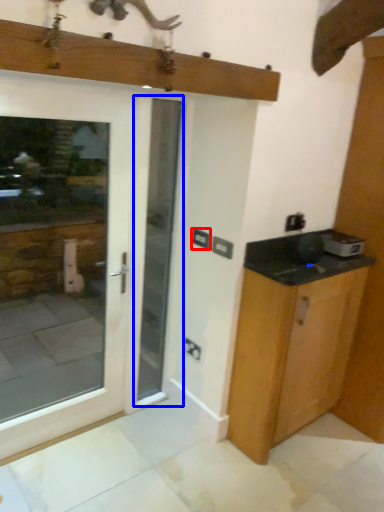
Question: Which of the following is the farthest to the observer, electric outlet (highlighted by a red box) or screen door (highlighted by a blue box)?

Choices:
 (A) electric outlet
 (B) screen door

Answer: (A)